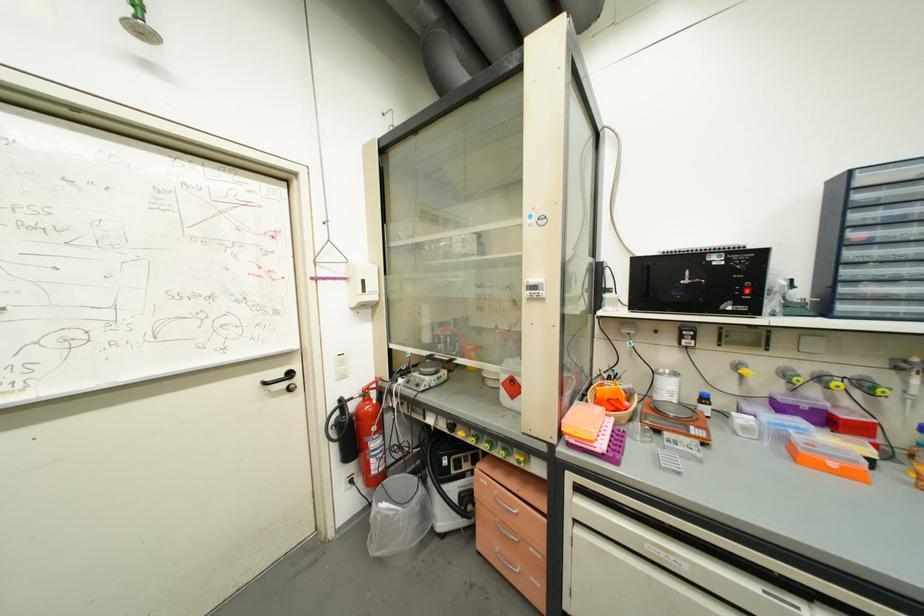
Which object does [799,407] point to?

This point indicates the blue lidded box.